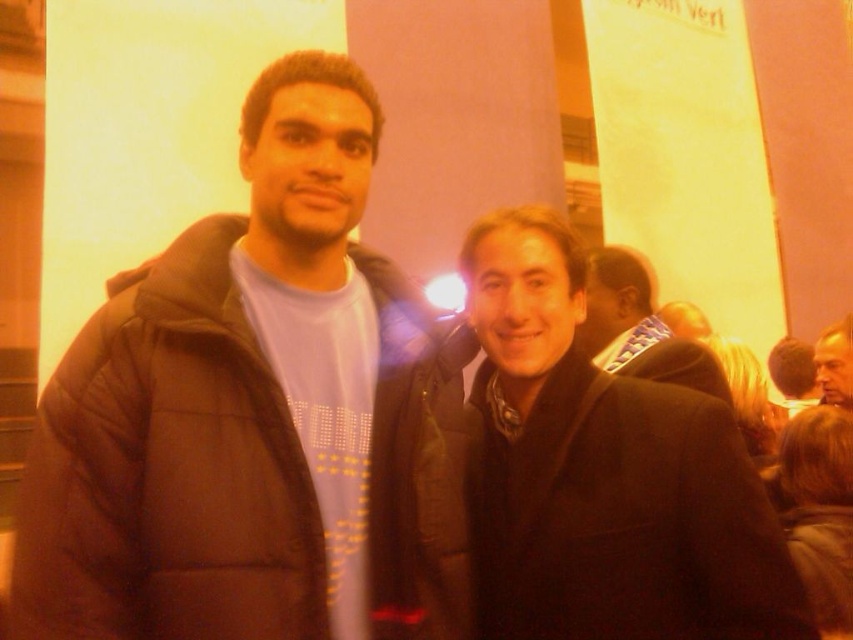
Does matte black jacket at center have a greater height compared to smooth gray jacket at upper right?

Correct, matte black jacket at center is much taller as smooth gray jacket at upper right.

Is matte black jacket at center to the left of smooth gray jacket at upper right from the viewer's perspective?

Correct, you'll find matte black jacket at center to the left of smooth gray jacket at upper right.

Between point (601, 257) and point (831, 387), which one is positioned in front?

Point (601, 257) is more forward.

Locate an element on the screen. The width and height of the screenshot is (853, 640). matte black jacket at center is located at coordinates (639, 328).

Between point (549, 456) and point (830, 403), which one is positioned behind?

The point (830, 403) is more distant.

Between black matte coat at center and smooth gray jacket at upper right, which one has more height?

Standing taller between the two is black matte coat at center.

I want to click on black matte coat at center, so click(602, 474).

Does black puffy jacket at left have a larger size compared to matte black jacket at center?

Indeed, black puffy jacket at left has a larger size compared to matte black jacket at center.

Between black puffy jacket at left and matte black jacket at center, which one has more height?

black puffy jacket at left

Which is behind, point (415, 413) or point (599, 275)?

The point (599, 275) is more distant.

In order to click on black puffy jacket at left in this screenshot , I will do `click(167, 472)`.